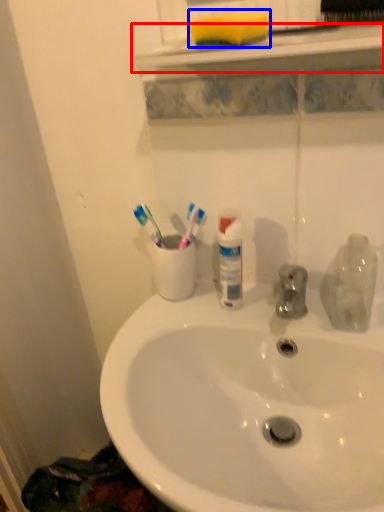
Question: Which object is further to the camera taking this photo, window sill (highlighted by a red box) or soap (highlighted by a blue box)?

Choices:
 (A) window sill
 (B) soap

Answer: (B)